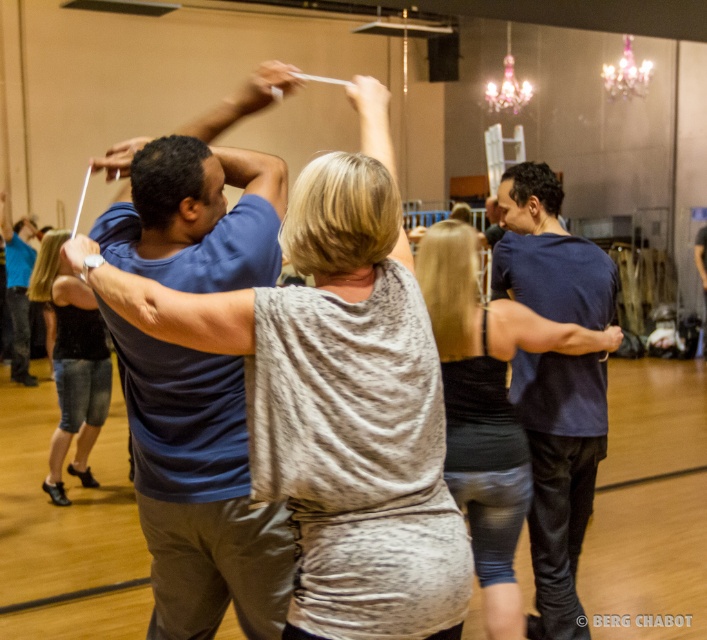
Please provide the coordinates of the dark blue shirt at center in the dance class image.

The dark blue shirt at center is located at coordinates point (559, 474).

You are a photographer positioned at the back of the dance studio. You want to take a photo that includes both the dark blue shirt at center and the blue denim jeans at lower left. Which object should you adjust your camera focus to first to ensure both are in clear view?

Since the dark blue shirt at center is closer to the viewer than the blue denim jeans at lower left, you should focus on the dark blue shirt at center first to ensure both are in clear view.

You are a photographer in the dance studio. You want to take a photo of both the blue cotton shirt at center and the dark blue shirt at center. Which one should you focus on first if you want to capture them from left to right order?

The blue cotton shirt at center is positioned on the left side of dark blue shirt at center, so you should focus on the blue cotton shirt at center first to capture them from left to right order.